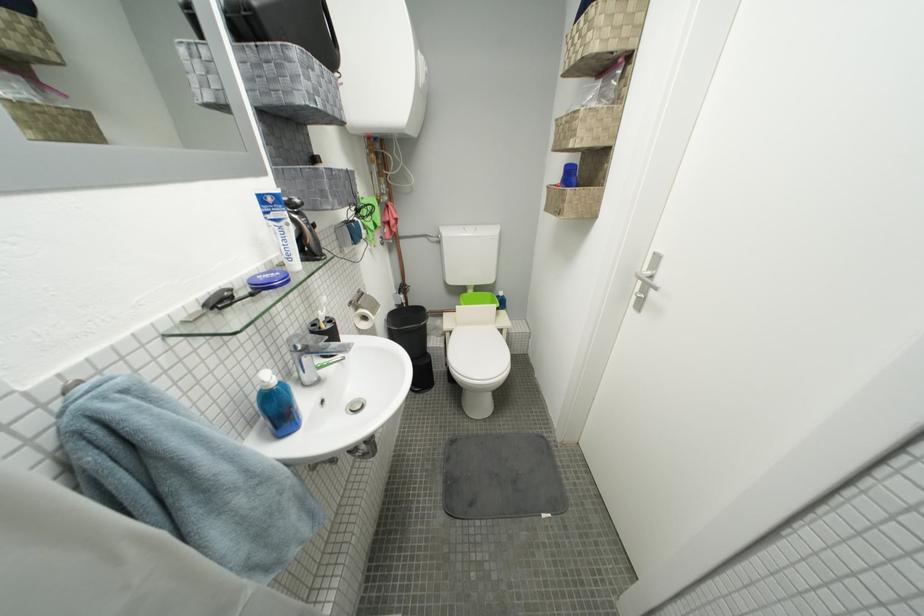
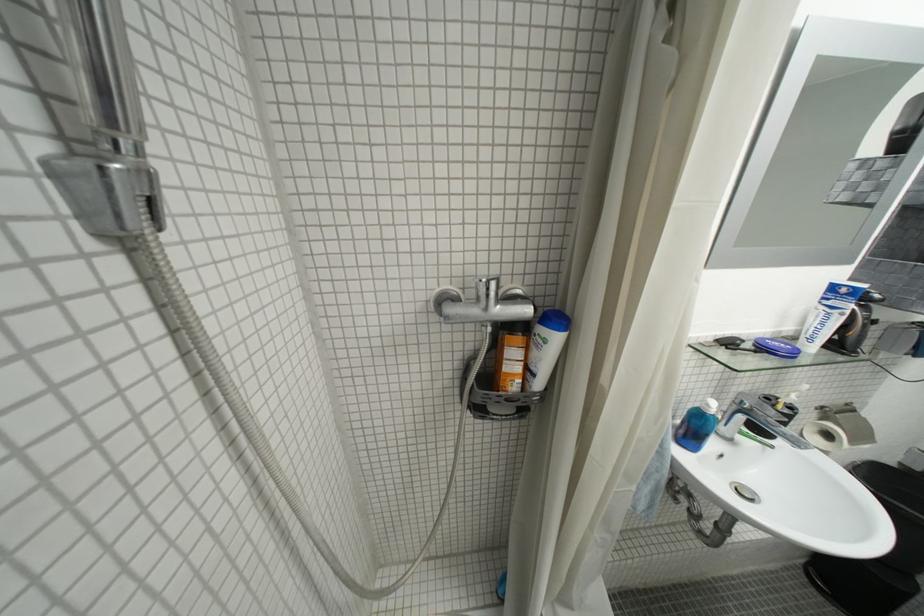
Where in the second image is the point corresponding to pixel 213 309 from the first image?

(725, 342)